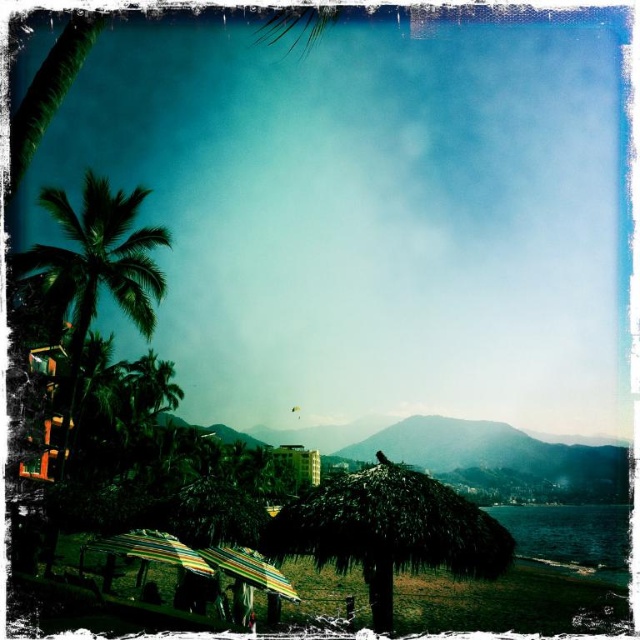
Question: Can you confirm if green leafy palm tree at left is positioned below thatched straw hut at center?

Choices:
 (A) yes
 (B) no

Answer: (B)

Question: Which point appears farthest from the camera in this image?

Choices:
 (A) (193, 556)
 (B) (147, 252)
 (C) (556, 550)
 (D) (387, 604)

Answer: (C)

Question: Can you confirm if thatched straw umbrella at center is smaller than multicolored striped umbrella at center?

Choices:
 (A) no
 (B) yes

Answer: (A)

Question: Which point is farther from the camera taking this photo?

Choices:
 (A) (582, 541)
 (B) (289, 444)

Answer: (B)

Question: Which object appears closest to the camera in this image?

Choices:
 (A) thatched straw umbrella at center
 (B) thatched straw hut at center
 (C) rainbow striped fabric umbrella at lower left
 (D) green leafy palm tree at left

Answer: (A)

Question: Can you confirm if green water at lower right is positioned below multicolored striped umbrella at center?

Choices:
 (A) no
 (B) yes

Answer: (B)